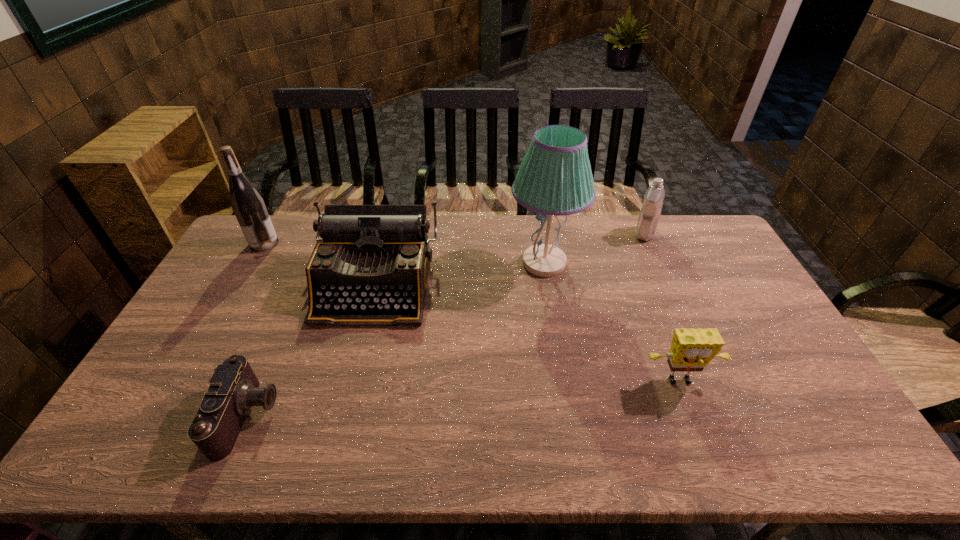
Find the location of a particular element. This screenshot has width=960, height=540. free spot located on the left of the detergent is located at coordinates (542, 234).

Find the location of `free space located 0.300m on the keyboard of the typewriter`. free space located 0.300m on the keyboard of the typewriter is located at coordinates (341, 420).

I want to click on free location located 0.140m on the front-facing side of the sponge, so click(x=705, y=447).

Image resolution: width=960 pixels, height=540 pixels. Find the location of `free space located on the front-facing side of the shortest object`. free space located on the front-facing side of the shortest object is located at coordinates (363, 416).

At what (x,y) coordinates should I click in order to perform the action: click on lamp that is at the far edge. Please return your answer as a coordinate pair (x, y). Looking at the image, I should click on (555, 178).

The image size is (960, 540). Identify the location of wine bottle at the far edge. (249, 208).

Locate an element on the screen. detergent at the far edge is located at coordinates (649, 216).

Identify the location of typewriter located at the far edge. (371, 266).

Identify the location of object situated at the near edge. The image size is (960, 540). (233, 389).

Identify the location of object that is at the left edge. The height and width of the screenshot is (540, 960). click(x=249, y=208).